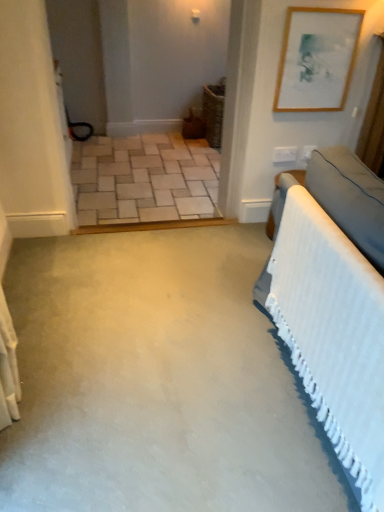
Question: Should I look upward or downward to see beige brick floor at center?

Choices:
 (A) up
 (B) down

Answer: (A)

Question: Could you tell me if velvet grey bed at right is turned towards wooden picture frame at upper right?

Choices:
 (A) no
 (B) yes

Answer: (A)

Question: Would you say velvet grey bed at right is outside wooden picture frame at upper right?

Choices:
 (A) no
 (B) yes

Answer: (B)

Question: Is velvet grey bed at right wider than wooden picture frame at upper right?

Choices:
 (A) yes
 (B) no

Answer: (A)

Question: Are velvet grey bed at right and wooden picture frame at upper right located far from each other?

Choices:
 (A) no
 (B) yes

Answer: (B)

Question: Can you confirm if velvet grey bed at right is positioned to the right of wooden picture frame at upper right?

Choices:
 (A) no
 (B) yes

Answer: (A)

Question: Considering the relative positions of velvet grey bed at right and wooden picture frame at upper right in the image provided, is velvet grey bed at right to the left of wooden picture frame at upper right from the viewer's perspective?

Choices:
 (A) yes
 (B) no

Answer: (A)

Question: Can you confirm if beige brick floor at center is shorter than wooden picture frame at upper right?

Choices:
 (A) yes
 (B) no

Answer: (A)

Question: Does beige brick floor at center have a greater height compared to wooden picture frame at upper right?

Choices:
 (A) yes
 (B) no

Answer: (B)

Question: Is beige brick floor at center thinner than wooden picture frame at upper right?

Choices:
 (A) no
 (B) yes

Answer: (A)

Question: Is wooden picture frame at upper right at the back of beige brick floor at center?

Choices:
 (A) yes
 (B) no

Answer: (B)

Question: Is beige brick floor at center not inside wooden picture frame at upper right?

Choices:
 (A) no
 (B) yes

Answer: (B)

Question: Is beige brick floor at center to the right of wooden picture frame at upper right from the viewer's perspective?

Choices:
 (A) yes
 (B) no

Answer: (B)

Question: Is the depth of velvet grey bed at right less than that of beige brick floor at center?

Choices:
 (A) yes
 (B) no

Answer: (A)